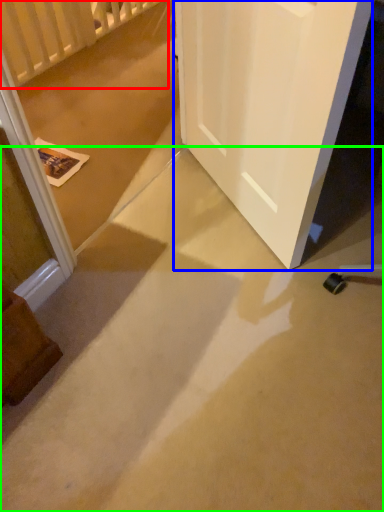
Question: Based on their relative distances, which object is nearer to balustrade (highlighted by a red box)? Choose from door (highlighted by a blue box) and concrete (highlighted by a green box).

Choices:
 (A) door
 (B) concrete

Answer: (A)